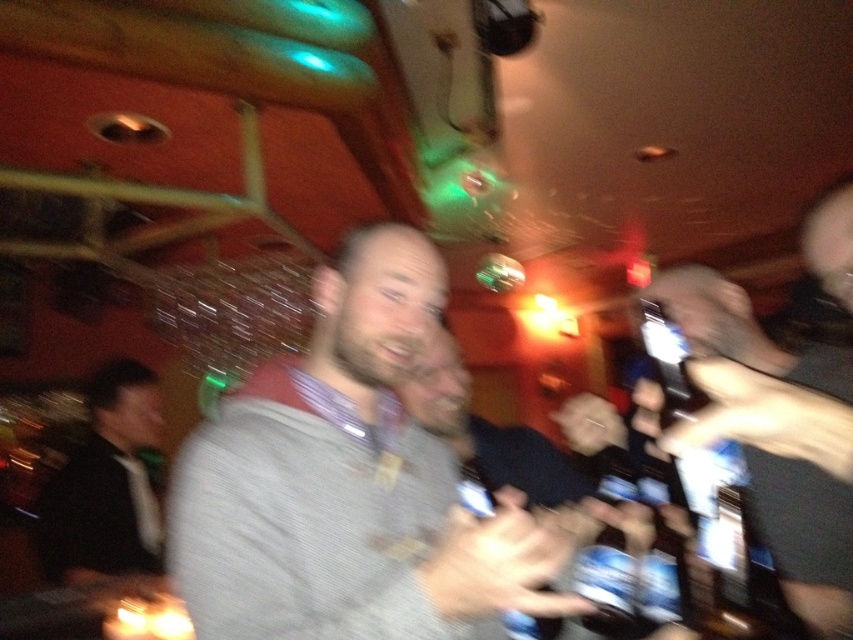
Locate an element on the screen. smooth leather jacket at right is located at coordinates (775, 435).

Between point (831, 252) and point (850, 413), which one is positioned behind?

Point (831, 252)

Image resolution: width=853 pixels, height=640 pixels. I want to click on smooth leather jacket at right, so click(775, 435).

Which is below, smooth leather jacket at right or black suit at left?

Positioned lower is black suit at left.

Between smooth leather jacket at right and black suit at left, which one has more height?

With more height is black suit at left.

Is point (741, 312) farther from viewer compared to point (151, 438)?

No, (741, 312) is closer to viewer.

Locate an element on the screen. smooth leather jacket at right is located at coordinates (775, 435).

Can you confirm if clear plastic bottle at right is smaller than metallic silver phone at right?

No.

Who is taller, clear plastic bottle at right or metallic silver phone at right?

clear plastic bottle at right

The width and height of the screenshot is (853, 640). What are the coordinates of `clear plastic bottle at right` in the screenshot? It's located at (721, 540).